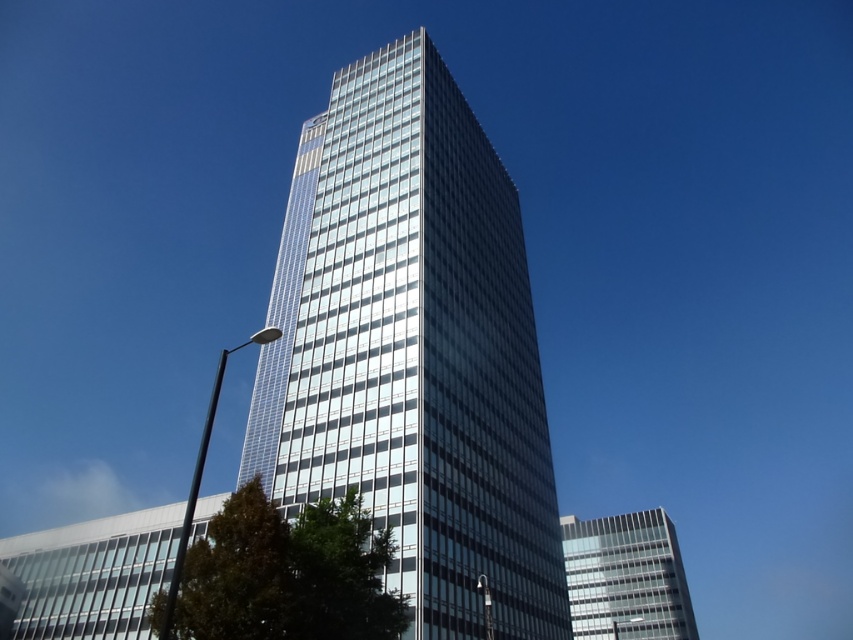
You are standing at the base of the skyscraper and want to take a photo of the point at coordinates point (503,554) on the building. If your camera has a maximum zoom range of 150 feet, will you be able to capture the point clearly?

The point (503,554) is 162.32 feet away from the camera. Since the camera can only zoom up to 150 feet, it won

You are an architect analyzing the urban layout. Given the transparent glass tower at center and the clear glass building at lower right, which one has a greater width according to the scene?

The transparent glass tower at center has a greater width than the clear glass building at lower right as stated in the description.

Based on the scene description, which object is taller between the transparent glass tower at center and the clear glass building at lower right?

The transparent glass tower at center is taller than the clear glass building at lower right.